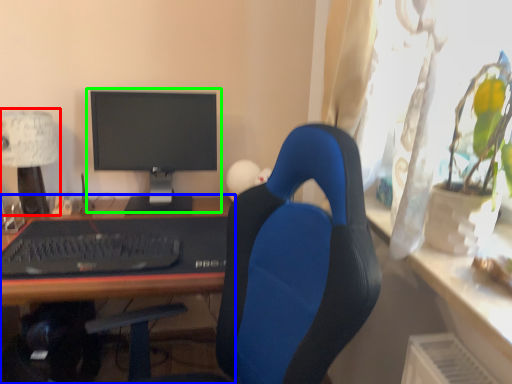
Question: Which object is positioned closest to table lamp (highlighted by a red box)? Select from desk (highlighted by a blue box) and computer monitor (highlighted by a green box).

Choices:
 (A) desk
 (B) computer monitor

Answer: (A)